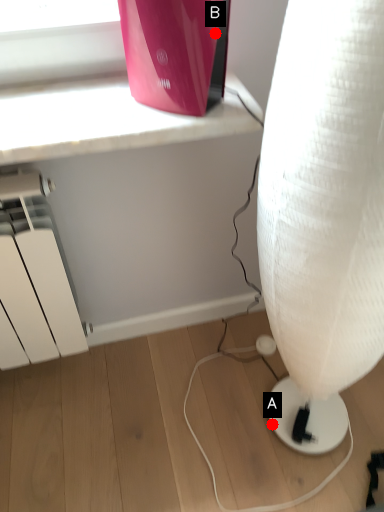
Question: Two points are circled on the image, labeled by A and B beside each circle. Which point is further to the camera?

Choices:
 (A) A is further
 (B) B is further

Answer: (A)